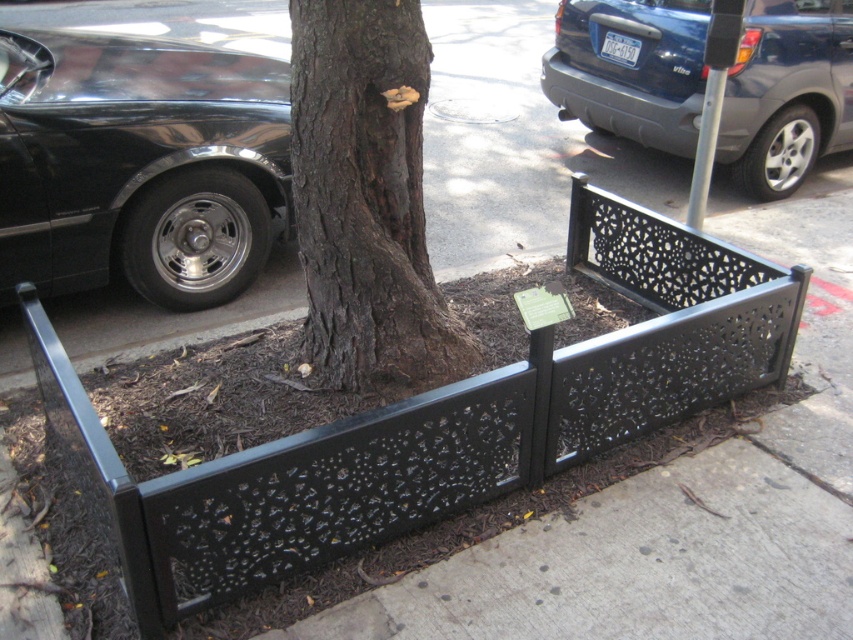
Question: Does shiny black car at left come behind green matte plaque at center?

Choices:
 (A) yes
 (B) no

Answer: (B)

Question: Is shiny black car at left positioned before green matte plaque at center?

Choices:
 (A) yes
 (B) no

Answer: (A)

Question: Among these objects, which one is nearest to the camera?

Choices:
 (A) brown rough bark at center
 (B) shiny black car at left

Answer: (A)

Question: Considering the real-world distances, which object is farthest from the brown rough bark at center?

Choices:
 (A) green matte plaque at center
 (B) black perforated metal planter at center
 (C) metallic blue suv at upper right

Answer: (C)

Question: Which of the following is the farthest from the observer?

Choices:
 (A) black metal/texture curb at lower left
 (B) shiny black car at left

Answer: (A)

Question: Does black metal/texture curb at lower left have a lesser width compared to green matte plaque at center?

Choices:
 (A) no
 (B) yes

Answer: (A)